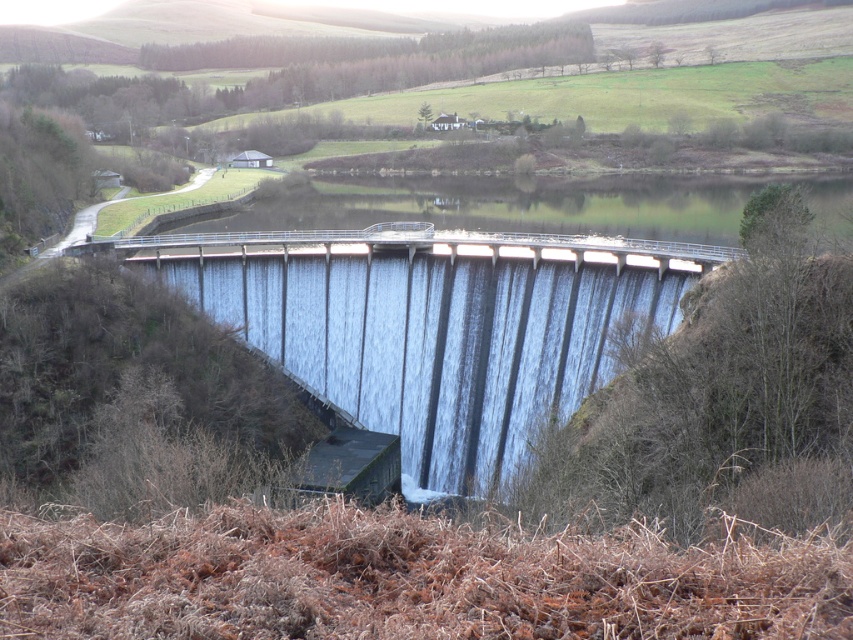
In the scene shown: Does smooth concrete dam at center appear over clear water at center?

No, smooth concrete dam at center is not above clear water at center.

Is point (326, 307) positioned in front of point (502, 221)?

Yes, it is in front of point (502, 221).

Who is more distant from viewer, (515, 276) or (814, 202)?

The point (814, 202) is more distant.

Where is `smooth concrete dam at center`? This screenshot has width=853, height=640. smooth concrete dam at center is located at coordinates (431, 324).